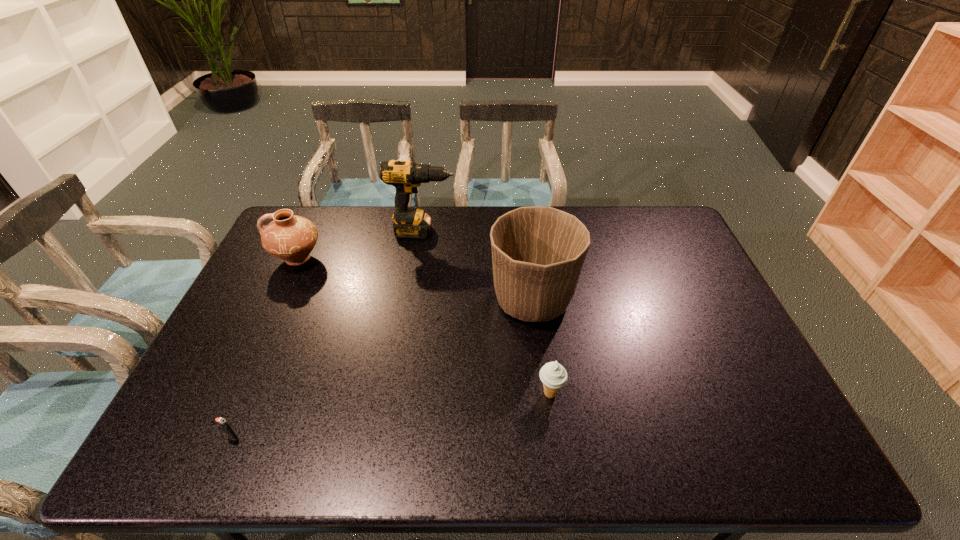
You are a GUI agent. You are given a task and a screenshot of the screen. Output one action in this format:
    pyautogui.click(x=<x>, y=<y>)
    Task: Click on the free point located on the back of the second shortest object
    
    Given the screenshot: What is the action you would take?
    pyautogui.click(x=543, y=345)

Locate an element on the screen. The width and height of the screenshot is (960, 540). free space located on the back of the igniter is located at coordinates (279, 330).

Locate an element on the screen. The image size is (960, 540). drill present at the far edge is located at coordinates pyautogui.click(x=405, y=176).

Where is `pottery that is positioned at the far edge`? pottery that is positioned at the far edge is located at coordinates (289, 237).

This screenshot has width=960, height=540. What are the coordinates of `object situated at the near edge` in the screenshot? It's located at (222, 422).

This screenshot has height=540, width=960. Find the location of `pottery positioned at the left edge`. pottery positioned at the left edge is located at coordinates (289, 237).

Find the location of a particular element. This screenshot has width=960, height=540. igniter situated at the left edge is located at coordinates (222, 422).

Locate an element on the screen. object that is at the far left corner is located at coordinates (289, 237).

The width and height of the screenshot is (960, 540). In order to click on object at the near left corner in this screenshot , I will do `click(222, 422)`.

Identify the location of free location at the far edge of the desktop. (473, 231).